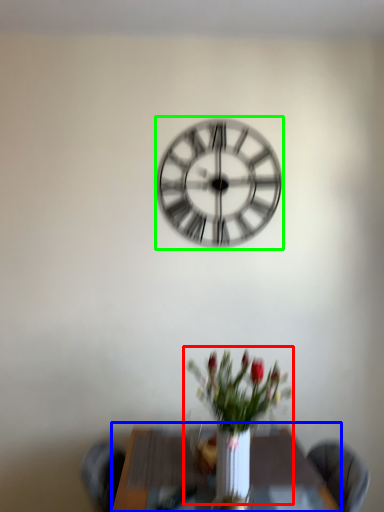
Question: Based on their relative distances, which object is nearer to floral arrangement (highlighted by a red box)? Choose from table (highlighted by a blue box) and wall clock (highlighted by a green box).

Choices:
 (A) table
 (B) wall clock

Answer: (A)